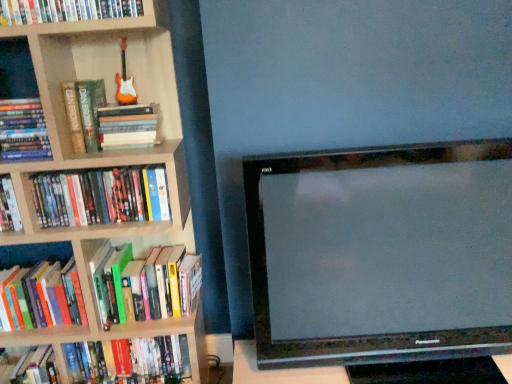
Where is `vacant area on top of hardcover book at left, the fourth book from the bottom (from a real-world perspective)`? vacant area on top of hardcover book at left, the fourth book from the bottom (from a real-world perspective) is located at coordinates (106, 170).